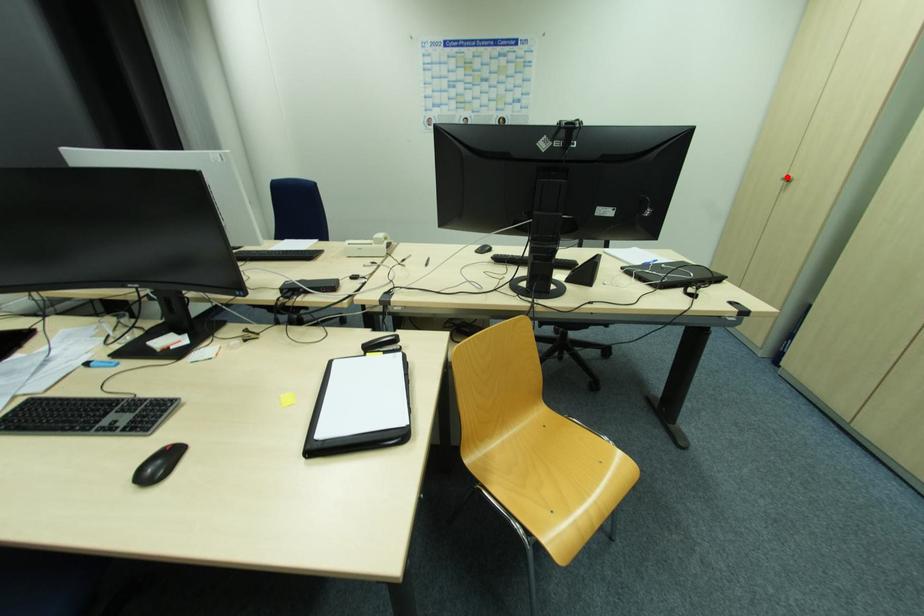
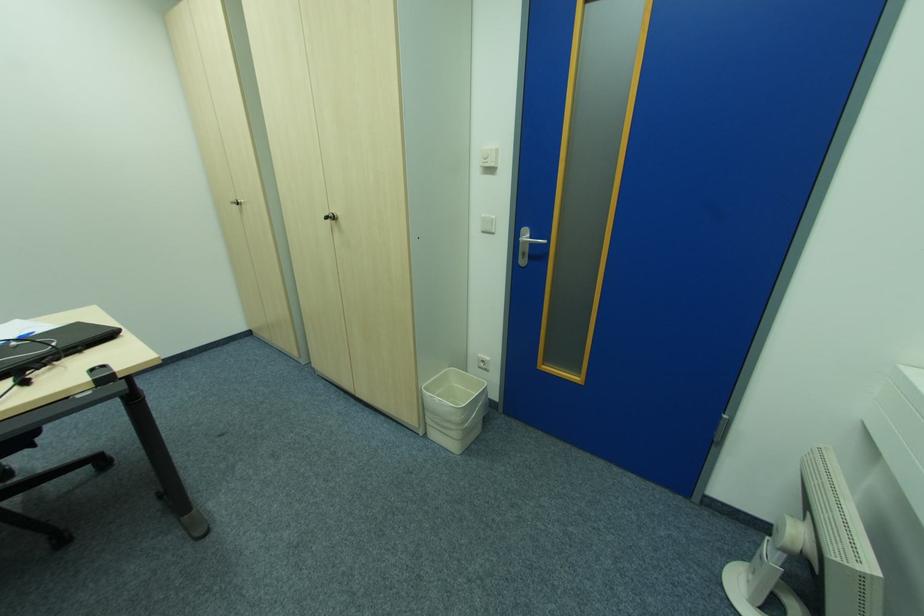
Find the pixel in the second image that matches the highlighted location in the first image.

(236, 201)